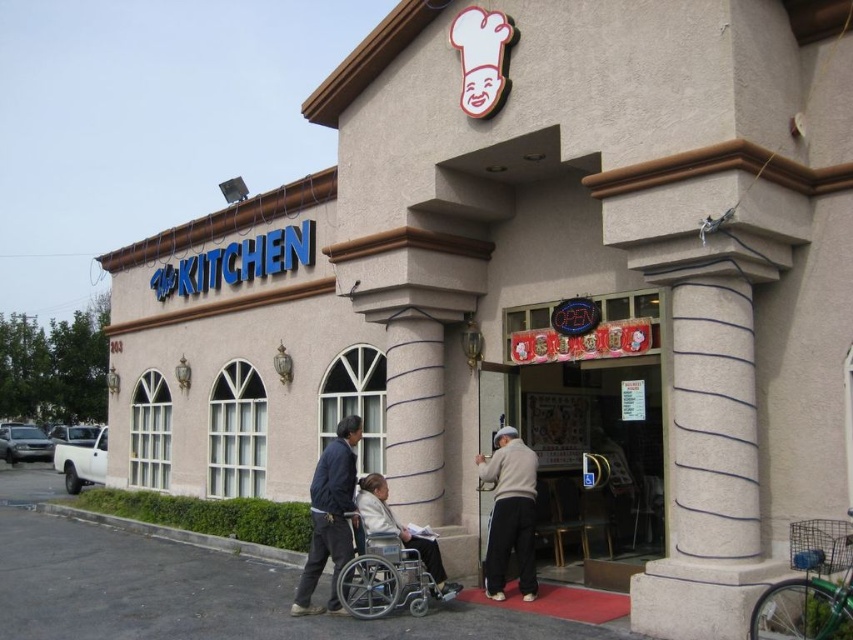
Is the position of light gray sweater at entrance more distant than that of dark blue jacket at center?

Yes, light gray sweater at entrance is further from the viewer.

Does point (491, 476) come closer to viewer compared to point (312, 586)?

No, (491, 476) is behind (312, 586).

Which is behind, point (495, 492) or point (349, 550)?

Positioned behind is point (495, 492).

Locate an element on the screen. The width and height of the screenshot is (853, 640). light gray sweater at entrance is located at coordinates (509, 513).

Who is positioned more to the right, dark blue jacket at center or silver metallic wheelchair at center?

silver metallic wheelchair at center

Where is `dark blue jacket at center`? This screenshot has height=640, width=853. dark blue jacket at center is located at coordinates (329, 515).

Locate an element on the screen. The width and height of the screenshot is (853, 640). dark blue jacket at center is located at coordinates (329, 515).

Which is behind, point (361, 593) or point (380, 522)?

Positioned behind is point (380, 522).

Is point (370, 604) in front of point (374, 502)?

Yes, it is.

Where is `silver metallic wheelchair at center`? The width and height of the screenshot is (853, 640). silver metallic wheelchair at center is located at coordinates pyautogui.click(x=386, y=579).